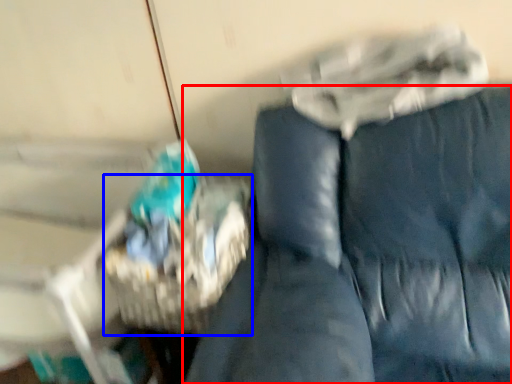
Question: Which of the following is the closest to the observer, furniture (highlighted by a red box) or basket (highlighted by a blue box)?

Choices:
 (A) furniture
 (B) basket

Answer: (A)